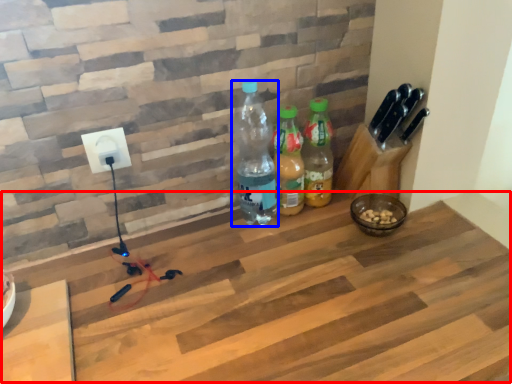
Question: Which object is closer to the camera taking this photo, workbench (highlighted by a red box) or bottle (highlighted by a blue box)?

Choices:
 (A) workbench
 (B) bottle

Answer: (A)